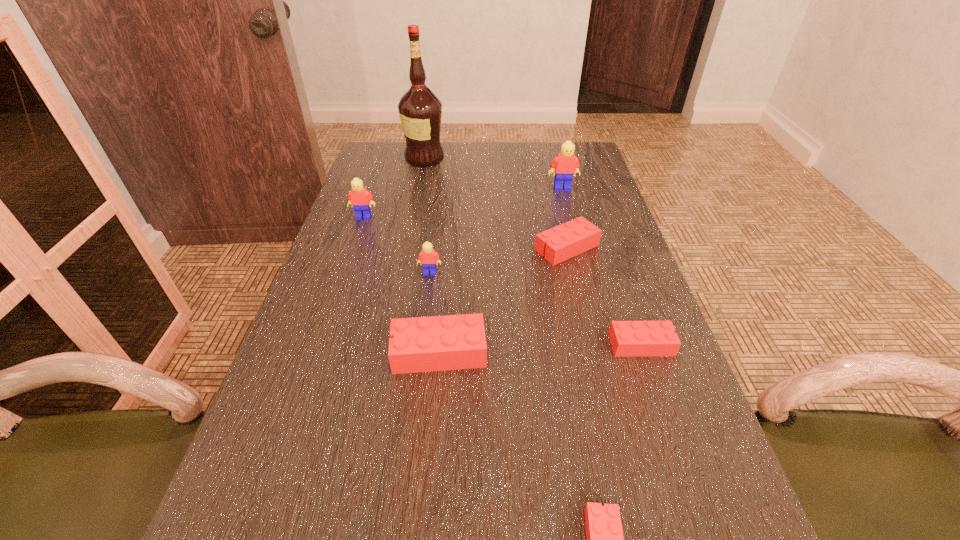
Image resolution: width=960 pixels, height=540 pixels. I want to click on vacant area located 0.190m on the back of the second smallest red Lego, so click(x=616, y=272).

Identify the location of object positioned at the far edge. This screenshot has height=540, width=960. (420, 110).

At what (x,y) coordinates should I click in order to perform the action: click on alcohol present at the left edge. Please return your answer as a coordinate pair (x, y). The height and width of the screenshot is (540, 960). Looking at the image, I should click on (420, 110).

Image resolution: width=960 pixels, height=540 pixels. In order to click on Lego situated at the left edge in this screenshot , I will do `click(358, 197)`.

Identify the location of object that is at the far left corner. Image resolution: width=960 pixels, height=540 pixels. (420, 110).

Where is `free space at the far edge of the desktop`? free space at the far edge of the desktop is located at coordinates (506, 162).

Where is `free space at the left edge of the desktop`? This screenshot has width=960, height=540. free space at the left edge of the desktop is located at coordinates (381, 193).

In the image, there is a desktop. At what (x,y) coordinates should I click in order to perform the action: click on vacant area at the right edge. Please return your answer as a coordinate pair (x, y). The height and width of the screenshot is (540, 960). Looking at the image, I should click on (680, 383).

Find the location of a particular element. The image size is (960, 540). free spot between the fourth tallest Lego and the fourth farthest object is located at coordinates (503, 300).

The image size is (960, 540). Find the location of `free space that is in between the second shortest object and the sixth nearest Lego`. free space that is in between the second shortest object and the sixth nearest Lego is located at coordinates (502, 281).